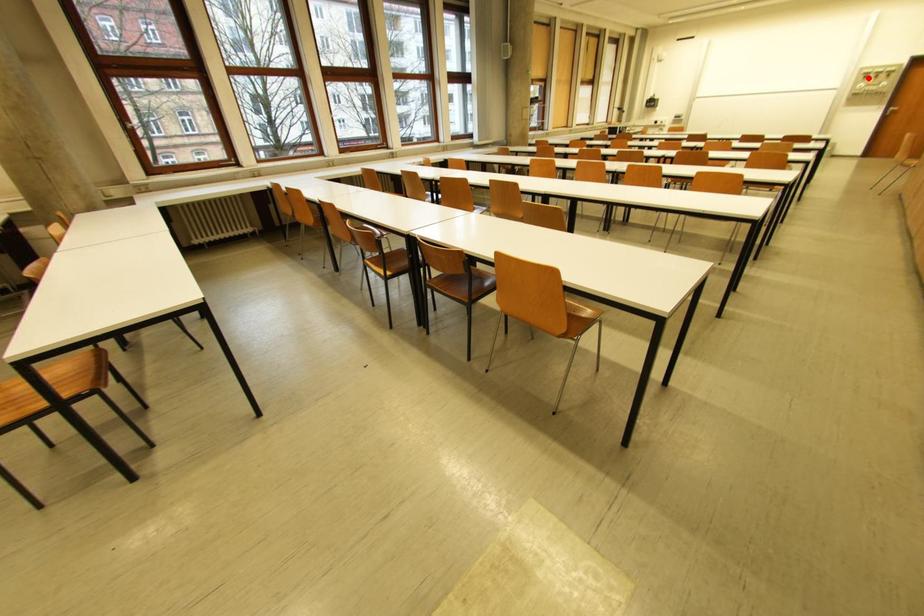
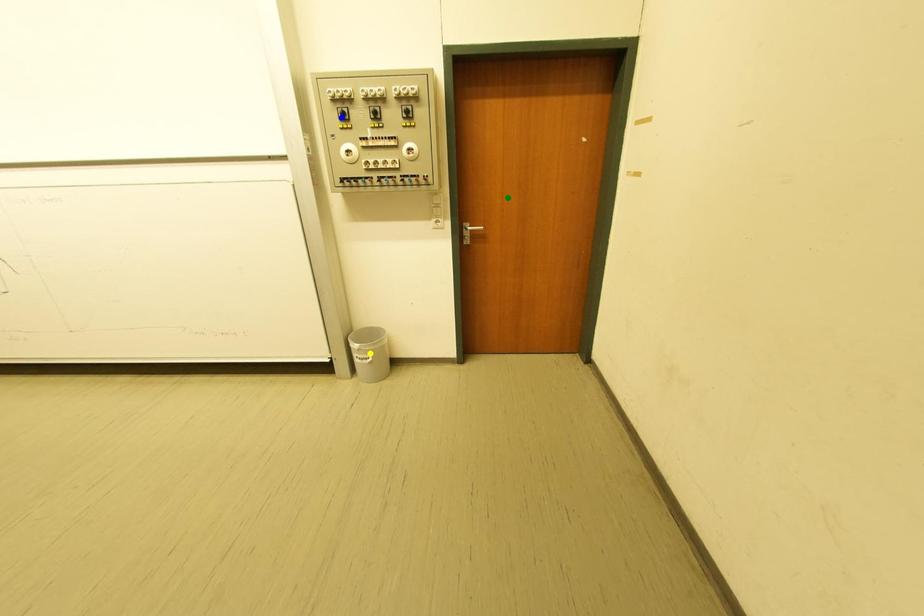
Question: I am providing you with two images of the same scene from different viewpoints. A red point is marked on the first image. You are given multiple points on the second image. Which point in image 2 is actually the same real-world point as the red point in image 1?

Choices:
 (A) yellow point
 (B) blue point
 (C) green point

Answer: (B)